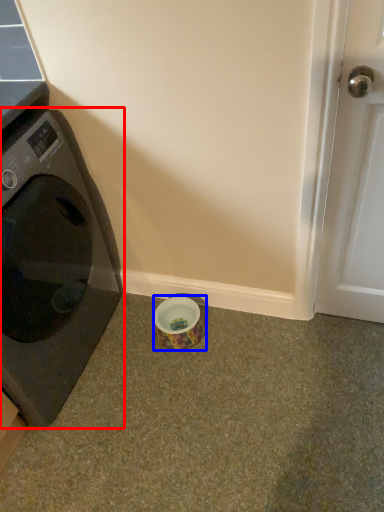
Question: Which of the following is the farthest to the observer, washing machine (highlighted by a red box) or tape (highlighted by a blue box)?

Choices:
 (A) washing machine
 (B) tape

Answer: (B)